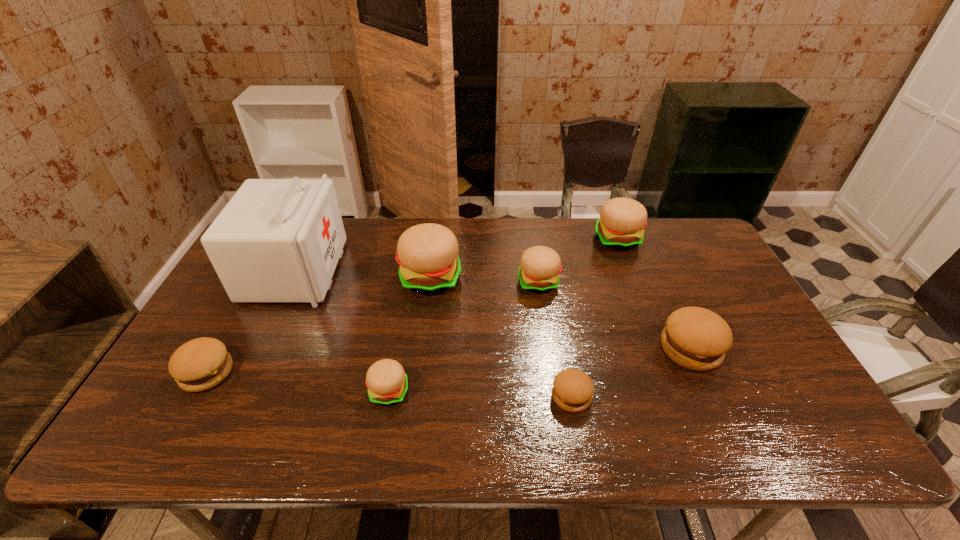
This screenshot has width=960, height=540. In order to click on vacant space that satisfies the following two spatial constraints: 1. on the back side of the seventh shortest object; 2. on the right side of the second tallest hamburger in this screenshot , I will do [435, 239].

This screenshot has height=540, width=960. What are the coordinates of `free spot that satisfies the following two spatial constraints: 1. on the front-facing side of the shortest object; 2. on the right side of the first-aid kit` in the screenshot? It's located at (237, 396).

Where is `free spot that satisfies the following two spatial constraints: 1. on the front-facing side of the tallest object; 2. on the front side of the leftmost hamburger`? free spot that satisfies the following two spatial constraints: 1. on the front-facing side of the tallest object; 2. on the front side of the leftmost hamburger is located at coordinates (248, 373).

Where is `vacant region that satisfies the following two spatial constraints: 1. on the front side of the second beige hamburger from right to left; 2. on the right side of the shortest object`? vacant region that satisfies the following two spatial constraints: 1. on the front side of the second beige hamburger from right to left; 2. on the right side of the shortest object is located at coordinates (555, 396).

This screenshot has width=960, height=540. In order to click on vacant position in the image that satisfies the following two spatial constraints: 1. on the back side of the rightmost brown hamburger; 2. on the left side of the smallest brown hamburger in this screenshot , I will do `click(563, 348)`.

The width and height of the screenshot is (960, 540). Identify the location of vacant position in the image that satisfies the following two spatial constraints: 1. on the front-facing side of the first-aid kit; 2. on the right side of the second smallest beige hamburger. (290, 282).